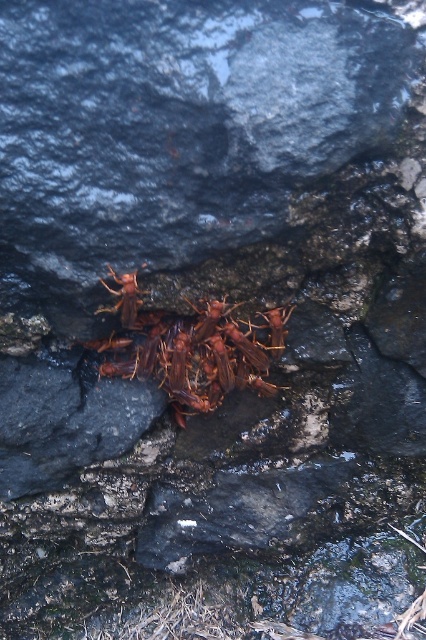
You are an entomologist observing the brown matte insects at center and the matte brown insect at center on a rocky surface. Which of these two is positioned lower in the image?

The brown matte insects at center is positioned lower than the matte brown insect at center.

You are an entomologist observing a cluster of insects on a rocky surface. You notice a specific point marked at coordinates [192,348]. What is located at that point?

The point at coordinates [192,348] marks brown matte insects at center.